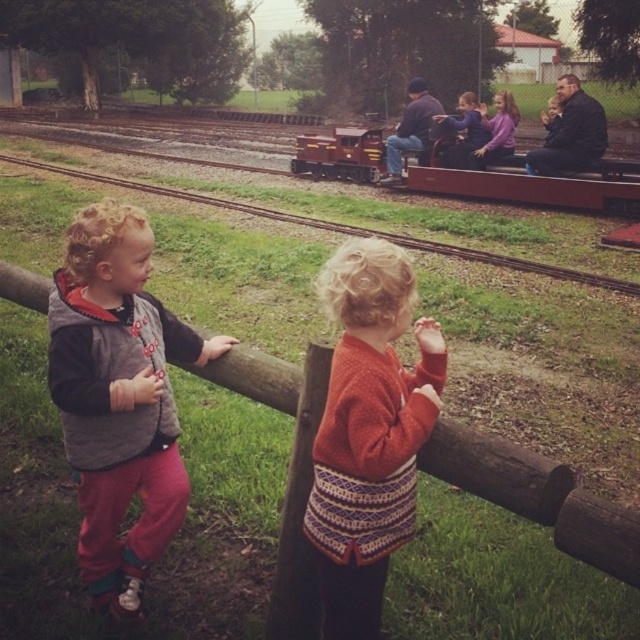
You are a clothing designer observing the two children at the train park. You notice the grey fleece vest at left and the knitted wool sweater at upper center. Which clothing item is bigger in size?

The grey fleece vest at left is larger in size compared to the knitted wool sweater at upper center.